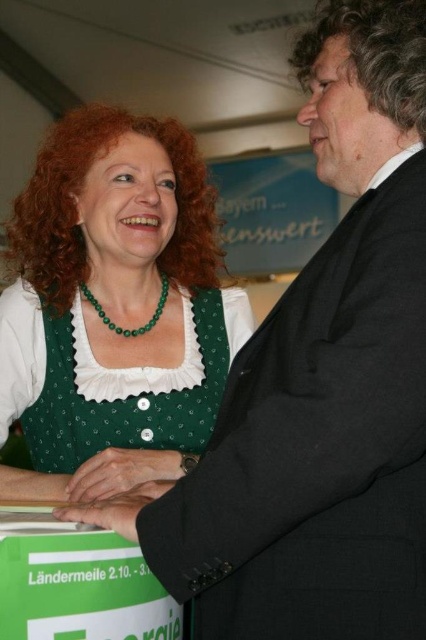
You are organizing a gift delivery service and need to decide whether the green beaded necklace at center can fit into the green cardboard box at lower left. Based on the scene description, can the necklace fit inside the box?

The green cardboard box at lower left is larger in size than the green beaded necklace at center, so the necklace can fit inside the box.

You are a photographer observing two people in the scene. You notice the green fabric hand at center and the green beaded necklace at center. Which object is positioned to the right side of the other?

The green fabric hand at center is to the right of the green beaded necklace at center, so the green fabric hand at center is positioned to the right side of the green beaded necklace at center.

You are designing a costume for a play and need to ensure that the green fabric hand at center and the green beaded necklace at center fit within a 15 cm wide display panel. Given their widths, which one will occupy more space horizontally?

The green fabric hand at center has a greater width than the green beaded necklace at center, so it will occupy more horizontal space and may not fit within the 15 cm panel if the necklace already takes up space.